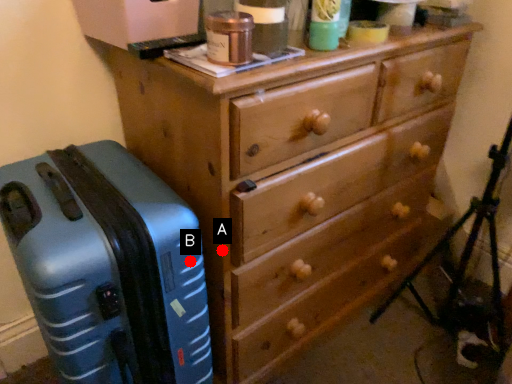
Question: Two points are circled on the image, labeled by A and B beside each circle. Which of the following is the closest to the observer?

Choices:
 (A) A is closer
 (B) B is closer

Answer: (B)